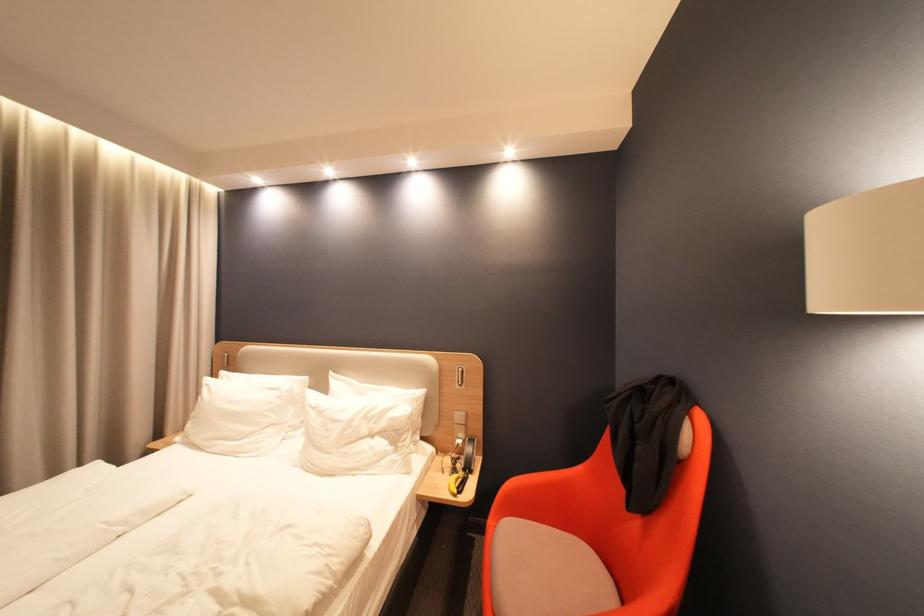
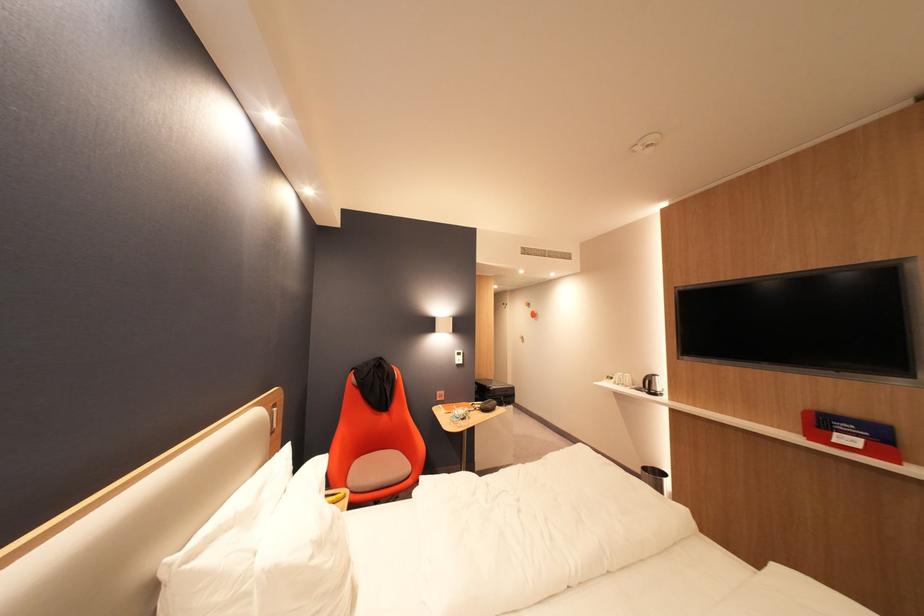
The point at (331, 414) is marked in the first image. Where is the corresponding point in the second image?

(330, 545)